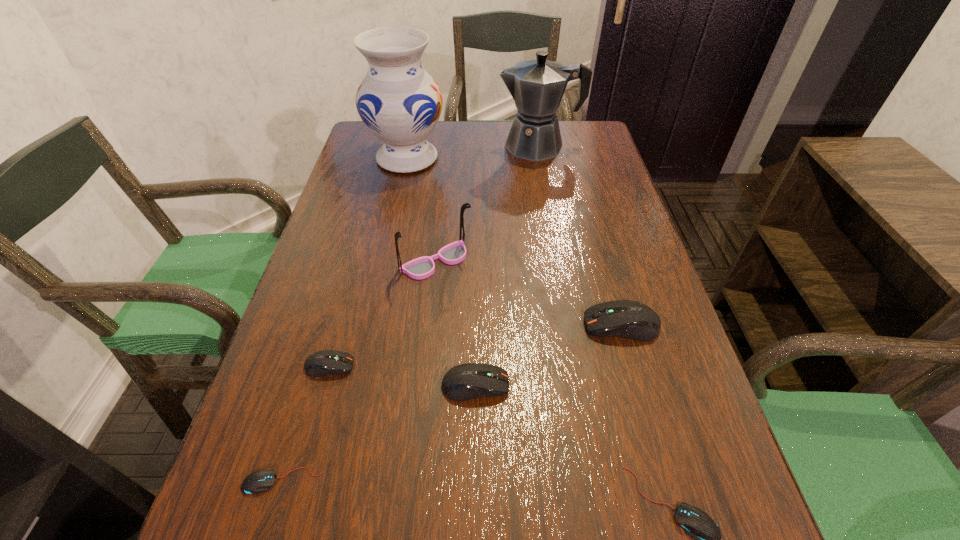
In order to click on vacant space situated on the button of the fourth tallest object in this screenshot , I will do `click(503, 325)`.

This screenshot has width=960, height=540. Identify the location of free space located 0.210m on the button of the second dark computer equipment from left to right. (627, 385).

Locate an element on the screen. The width and height of the screenshot is (960, 540). free region located on the button of the leftmost dark computer equipment is located at coordinates (468, 366).

The image size is (960, 540). I want to click on vacant space located on the back of the smaller black mouse, so click(x=324, y=341).

This screenshot has height=540, width=960. What are the coordinates of `vase located in the far edge section of the desktop` in the screenshot? It's located at (399, 102).

Find the location of a particular element. The width and height of the screenshot is (960, 540). coffeepot that is positioned at the far edge is located at coordinates pyautogui.click(x=537, y=86).

I want to click on vase at the left edge, so click(399, 102).

You are a GUI agent. You are given a task and a screenshot of the screen. Output one action in this format:
    pyautogui.click(x=<x>, y=<y>)
    Task: Click on the coffeepot present at the right edge
    
    Given the screenshot: What is the action you would take?
    pyautogui.click(x=537, y=86)

Find the location of `computer equipment that is at the right edge`. computer equipment that is at the right edge is located at coordinates (629, 319).

You are a GUI agent. You are given a task and a screenshot of the screen. Output one action in this format:
    pyautogui.click(x=<x>, y=<y>)
    Task: Click on the object at the far left corner
    This screenshot has width=960, height=540.
    Given the screenshot: What is the action you would take?
    pyautogui.click(x=399, y=102)